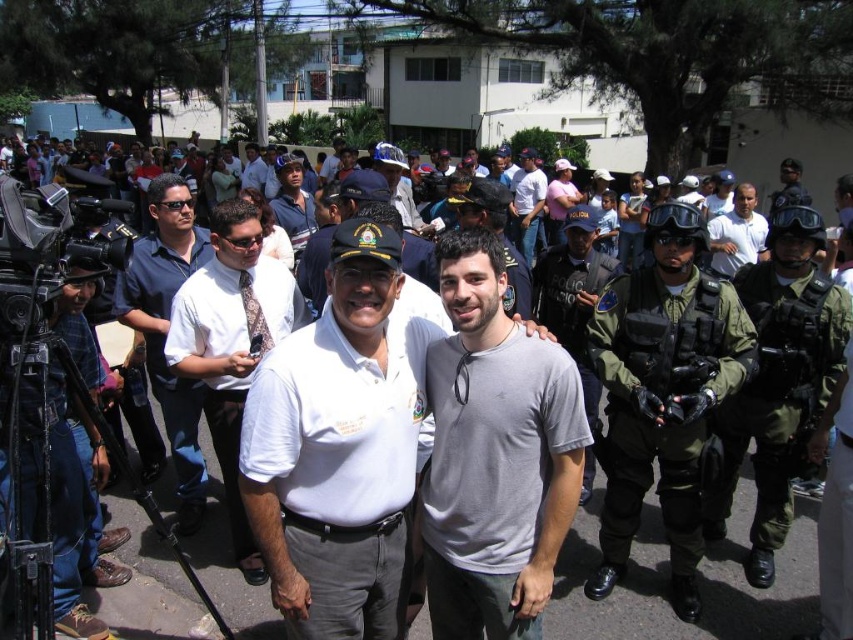
The height and width of the screenshot is (640, 853). Describe the element at coordinates (779, 380) in the screenshot. I see `green tactical gear at right` at that location.

Does green tactical gear at right have a smaller size compared to white shirt at center?

Yes, green tactical gear at right is smaller than white shirt at center.

Locate an element on the screen. green tactical gear at right is located at coordinates (779, 380).

Is point (256, 346) positioned before point (740, 262)?

Yes, it is in front of point (740, 262).

Which is in front, point (193, 378) or point (759, 256)?

Point (193, 378)

At what (x,y) coordinates should I click in order to perform the action: click on white shirt at center. Please return your answer as a coordinate pair (x, y). Image resolution: width=853 pixels, height=640 pixels. Looking at the image, I should click on (231, 342).

From the picture: Between matte black shirt at left and green uniformed officer at right, which one appears on the left side from the viewer's perspective?

matte black shirt at left

Who is more distant from viewer, (167, 216) or (772, 196)?

Positioned behind is point (772, 196).

This screenshot has height=640, width=853. Find the location of `matte black shirt at left`. matte black shirt at left is located at coordinates (167, 328).

Locate an element on the screen. matte black shirt at left is located at coordinates (167, 328).